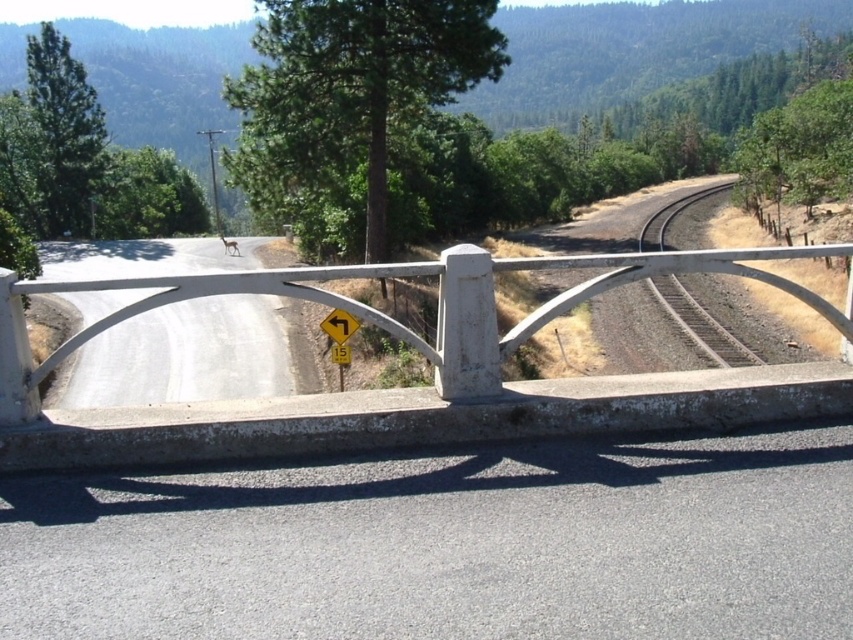
You are a cyclist approaching the brown gravel track at right and the yellow plastic traffic sign at center. Which object is located higher in the image?

The brown gravel track at right is positioned over the yellow plastic traffic sign at center, so it is higher in the image.

You are standing at the intersection of the paved road and the brown gravel track at right. Which direction should you head to reach the railway track mentioned in the scene description?

The brown gravel track at right is located at point (x=700, y=324), so you should head towards the direction of the brown gravel track at right to reach the railway track mentioned in the scene description.